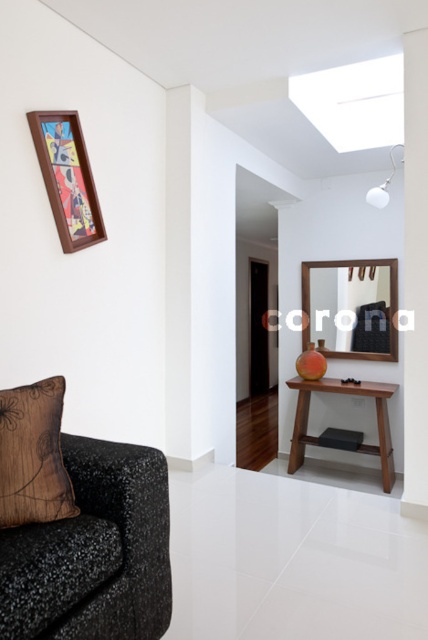
Does black speckled fabric couch at lower left have a greater height compared to brown textured pillow at lower left?

Yes.

Based on the photo, who is more distant from viewer, (163, 522) or (56, 412)?

Point (163, 522)

Which is in front, point (155, 508) or point (29, 488)?

Point (29, 488)

Locate an element on the screen. black speckled fabric couch at lower left is located at coordinates pyautogui.click(x=94, y=552).

Is black speckled fabric couch at lower left shorter than mahogany wood console table at center?

Indeed, black speckled fabric couch at lower left has a lesser height compared to mahogany wood console table at center.

Can you confirm if black speckled fabric couch at lower left is taller than mahogany wood console table at center?

No.

Find the location of a particular element. This screenshot has width=428, height=640. black speckled fabric couch at lower left is located at coordinates (94, 552).

Who is taller, brown textured pillow at lower left or wooden picture frame at upper left?

With more height is wooden picture frame at upper left.

Who is positioned more to the right, brown textured pillow at lower left or wooden picture frame at upper left?

brown textured pillow at lower left is more to the right.

What do you see at coordinates (32, 456) in the screenshot? This screenshot has height=640, width=428. I see `brown textured pillow at lower left` at bounding box center [32, 456].

The height and width of the screenshot is (640, 428). In order to click on brown textured pillow at lower left in this screenshot , I will do (32, 456).